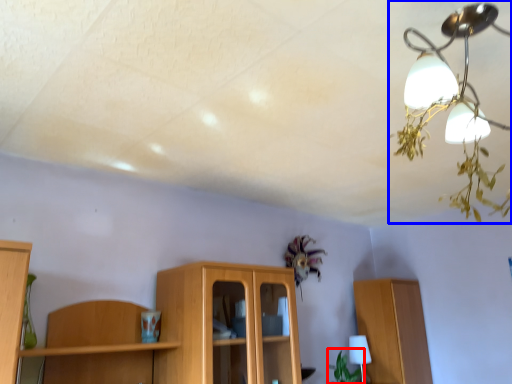
Question: Which of the following is the farthest to the observer, plant (highlighted by a red box) or lamp (highlighted by a blue box)?

Choices:
 (A) plant
 (B) lamp

Answer: (A)